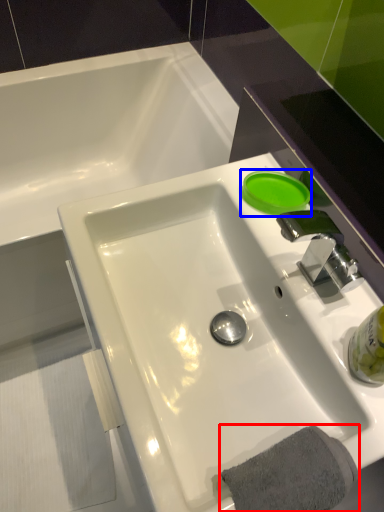
Question: Which object is further to the camera taking this photo, bath towel (highlighted by a red box) or liquid (highlighted by a blue box)?

Choices:
 (A) bath towel
 (B) liquid

Answer: (B)